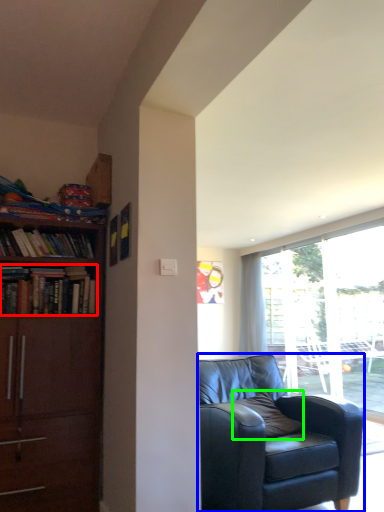
Question: Which object is positioned closest to book (highlighted by a red box)? Select from chair (highlighted by a blue box) and pillow (highlighted by a green box).

Choices:
 (A) chair
 (B) pillow

Answer: (A)